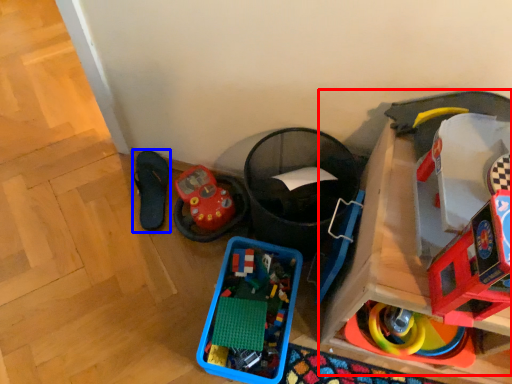
Question: Which point is further to the camera, toy (highlighted by a red box) or footwear (highlighted by a blue box)?

Choices:
 (A) toy
 (B) footwear

Answer: (B)